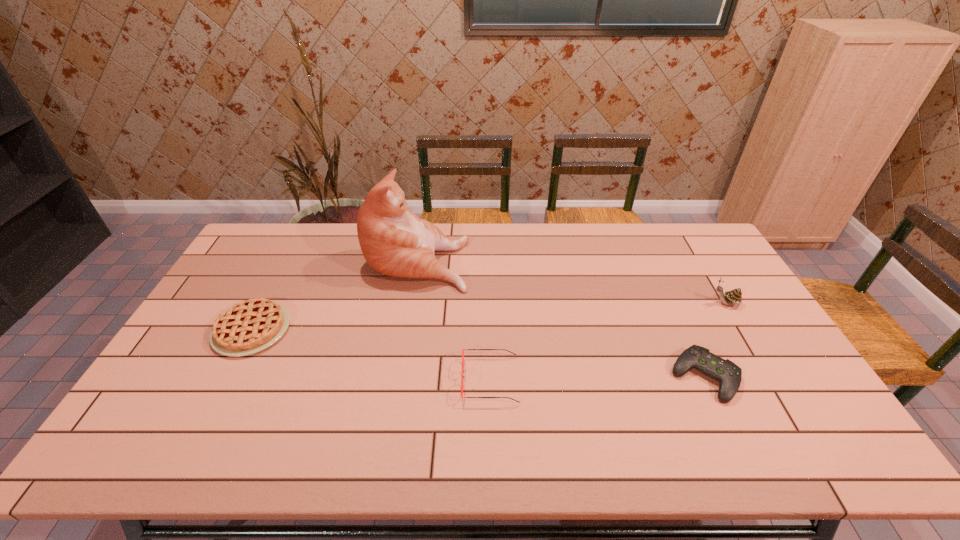
You are a GUI agent. You are given a task and a screenshot of the screen. Output one action in this format:
    pyautogui.click(x=<x>, y=<y>)
    Task: Click on the vacant region located on the face of the snail
    
    Given the screenshot: What is the action you would take?
    pyautogui.click(x=687, y=303)

Identify the location of free space located 0.060m on the front-facing side of the third shortest object. The image size is (960, 540). (440, 380).

At what (x,y) coordinates should I click in order to perform the action: click on blank space located 0.150m on the front-facing side of the third shortest object. Please return your answer as a coordinate pair (x, y). This screenshot has height=540, width=960. Looking at the image, I should click on (406, 380).

Identify the location of free space located on the front-facing side of the third shortest object. (395, 380).

I want to click on free space located 0.330m on the back of the leftmost object, so click(298, 241).

Identify the location of vacant space located 0.070m on the back of the control. The image size is (960, 540). (684, 333).

Where is `object at the far edge`? The height and width of the screenshot is (540, 960). object at the far edge is located at coordinates (394, 241).

Locate an element on the screen. object that is positioned at the left edge is located at coordinates (250, 326).

Identify the location of snail that is at the right edge. (734, 297).

You are a GUI agent. You are given a task and a screenshot of the screen. Output one action in this format:
    pyautogui.click(x=<x>, y=<y>)
    Task: Click on the control present at the right edge
    
    Given the screenshot: What is the action you would take?
    pyautogui.click(x=729, y=375)